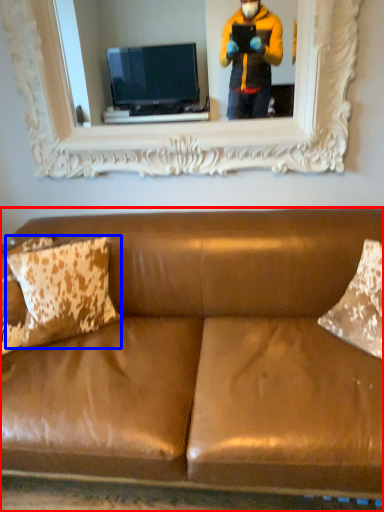
Question: Which object appears closest to the camera in this image, studio couch (highlighted by a red box) or pillow (highlighted by a blue box)?

Choices:
 (A) studio couch
 (B) pillow

Answer: (A)